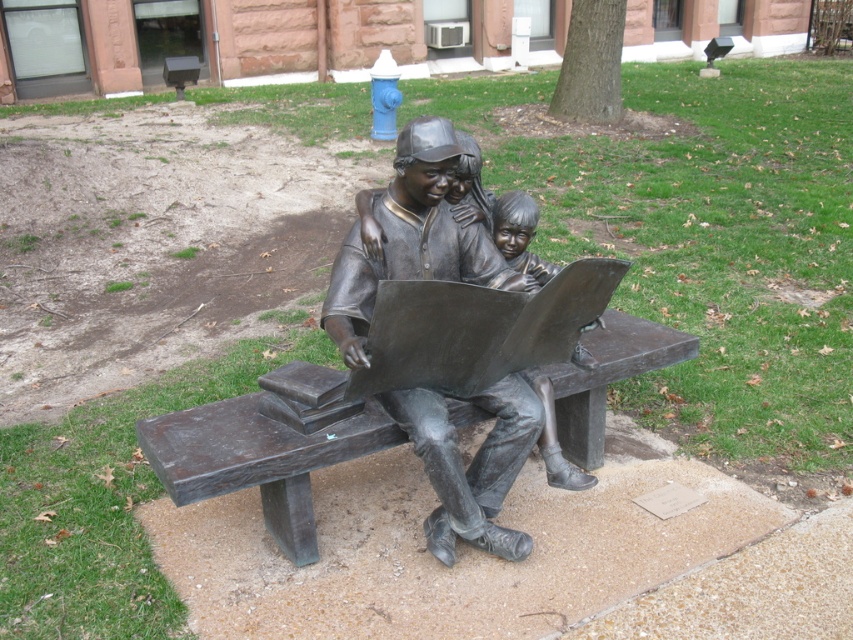
You are a park visitor who wants to take a photo of the bronze statue at center and the bronze bench at center together in one frame. Given that your camera can only focus on objects within 20 inches of each other, will you be able to capture both in focus?

The bronze statue at center is 22.23 inches from bronze bench at center. Since the distance exceeds the camera focus range of 20 inches, you won not be able to capture both in focus.